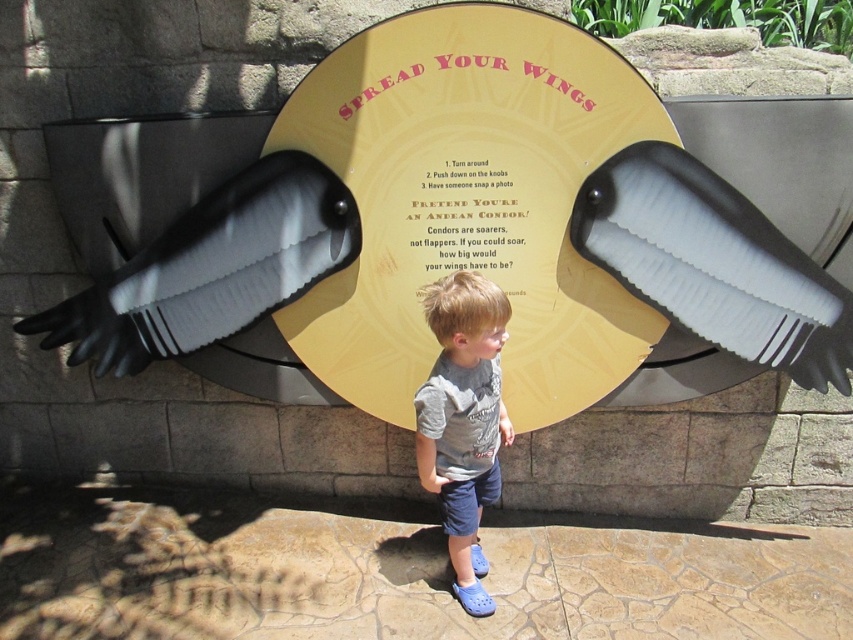
You are a visitor at the exhibit and want to know if the matte yellow sign at center is wider than the matte black wing at right. Can you determine this based on the information provided?

The matte yellow sign at center might be wider than matte black wing at right according to the description provided.

You are at the exhibit and want to take a photo with the matte yellow sign at center and the black matte eagle at left. Which object should you stand closer to if you want both to be clearly visible in the photo?

You should stand closer to the black matte eagle at left because the matte yellow sign at center is larger in size, so moving closer to the smaller object helps balance their sizes in the photo.

You are a parent helping your child at the condor exhibit. The child wants to know which object has wider wings between the matte black wing at right and the black matte eagle at left. What do you tell them?

The black matte eagle at left has wider wings than the matte black wing at right since the matte black wing at right is narrower.